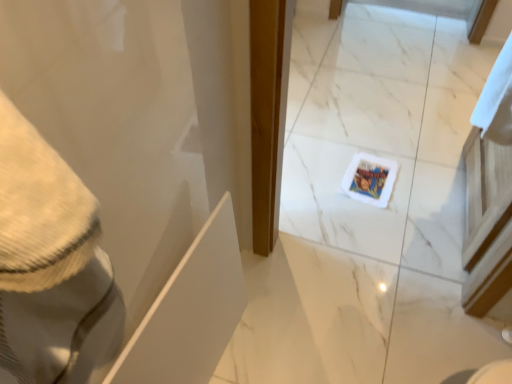
You are a GUI agent. You are given a task and a screenshot of the screen. Output one action in this format:
    pyautogui.click(x=<x>, y=<y>)
    Task: Click on the free space to the back side of white plastic container at center
    This screenshot has height=384, width=512.
    Given the screenshot: What is the action you would take?
    pyautogui.click(x=362, y=153)